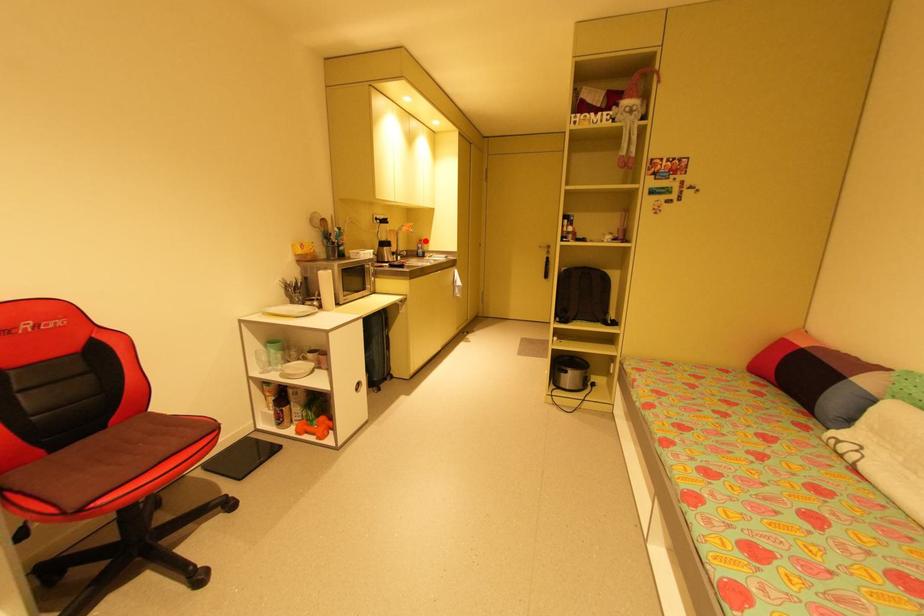
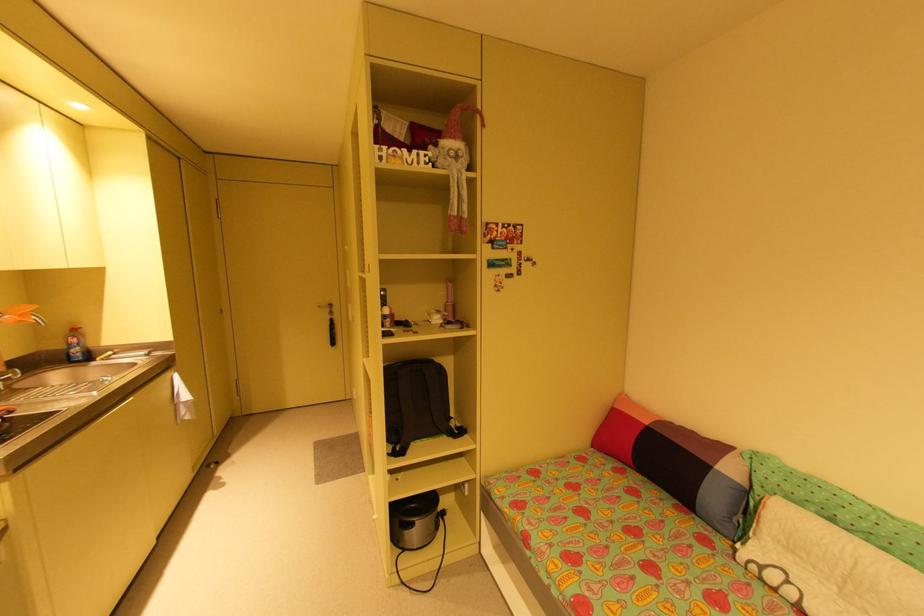
Question: I am providing you with two images of the same scene from different viewpoints. Given a red point in image1, look at the same physical point in image2. Is it:

Choices:
 (A) Closer to the viewpoint
 (B) Farther from the viewpoint

Answer: (B)